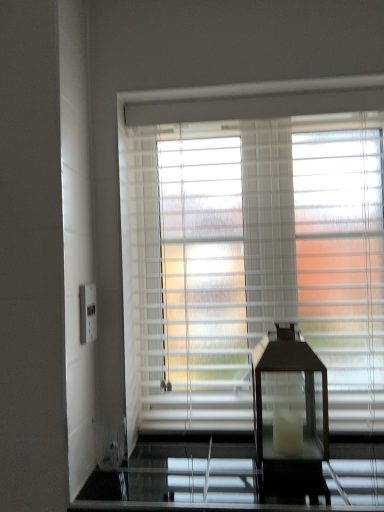
Question: Should I look upward or downward to see black glass table lamp at center?

Choices:
 (A) down
 (B) up

Answer: (A)

Question: Considering the relative positions of white plastic electric outlet at left and white textured blinds at center in the image provided, is white plastic electric outlet at left to the right of white textured blinds at center from the viewer's perspective?

Choices:
 (A) yes
 (B) no

Answer: (B)

Question: Is white plastic electric outlet at left surrounding white textured blinds at center?

Choices:
 (A) yes
 (B) no

Answer: (B)

Question: From the image's perspective, is white plastic electric outlet at left located above white textured blinds at center?

Choices:
 (A) yes
 (B) no

Answer: (B)

Question: Is white plastic electric outlet at left at the left side of white textured blinds at center?

Choices:
 (A) yes
 (B) no

Answer: (A)

Question: Is white plastic electric outlet at left aimed at white textured blinds at center?

Choices:
 (A) yes
 (B) no

Answer: (B)

Question: Does white plastic electric outlet at left have a lesser width compared to white textured blinds at center?

Choices:
 (A) yes
 (B) no

Answer: (A)

Question: From a real-world perspective, is white textured blinds at center beneath white plastic electric outlet at left?

Choices:
 (A) yes
 (B) no

Answer: (B)

Question: Is white textured blinds at center facing towards white plastic electric outlet at left?

Choices:
 (A) yes
 (B) no

Answer: (B)

Question: Is white textured blinds at center thinner than white plastic electric outlet at left?

Choices:
 (A) yes
 (B) no

Answer: (B)

Question: Are white textured blinds at center and white plastic electric outlet at left located far from each other?

Choices:
 (A) no
 (B) yes

Answer: (A)

Question: Considering the relative sizes of white textured blinds at center and white plastic electric outlet at left in the image provided, is white textured blinds at center wider than white plastic electric outlet at left?

Choices:
 (A) yes
 (B) no

Answer: (A)

Question: Is white textured blinds at center at the right side of white plastic electric outlet at left?

Choices:
 (A) no
 (B) yes

Answer: (B)

Question: Could you tell me if black glass table lamp at center is turned towards white plastic electric outlet at left?

Choices:
 (A) no
 (B) yes

Answer: (A)